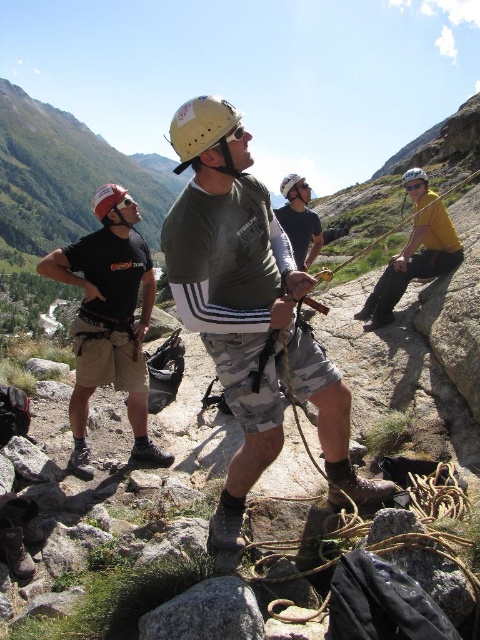
Question: Does matte green shirt at center have a larger size compared to matte black t-shirt at left?

Choices:
 (A) yes
 (B) no

Answer: (B)

Question: Can you confirm if matte black t-shirt at left is positioned to the right of yellow matte shirt at right?

Choices:
 (A) yes
 (B) no

Answer: (B)

Question: Considering the real-world distances, which object is farthest from the matte white helmet at upper right?

Choices:
 (A) red matte helmet at upper left
 (B) yellow matte helmet at center

Answer: (A)

Question: Which point is farther to the camera?

Choices:
 (A) matte green shirt at center
 (B) yellow matte shirt at right
 (C) matte white helmet at upper right

Answer: (C)

Question: Which point is farther to the camera?

Choices:
 (A) (94, 196)
 (B) (328, 456)
 (C) (427, 237)
 (D) (290, 176)

Answer: (A)

Question: Is the position of red matte helmet at upper left less distant than that of white matte helmet at center?

Choices:
 (A) no
 (B) yes

Answer: (B)